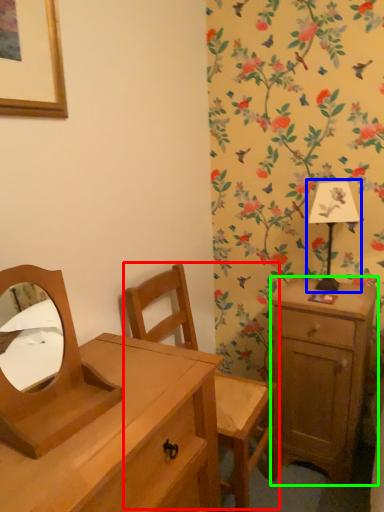
Question: Which object is the closest to the swivel chair (highlighted by a red box)? Choose among these: bedside lamp (highlighted by a blue box) or nightstand (highlighted by a green box).

Choices:
 (A) bedside lamp
 (B) nightstand

Answer: (B)